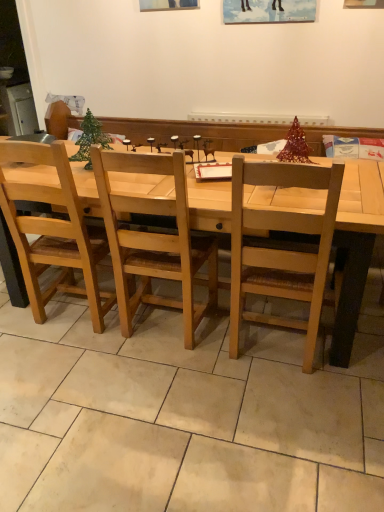
Question: Is light brown wood chair at center, the second chair positioned from the right, inside the boundaries of natural wood table at center, or outside?

Choices:
 (A) outside
 (B) inside

Answer: (B)

Question: Is point (41, 154) positioned closer to the camera than point (344, 237)?

Choices:
 (A) farther
 (B) closer

Answer: (A)

Question: Considering the real-world distances, which object is farthest from the natural wood table at center?

Choices:
 (A) metallic green christmas tree at center
 (B) light brown wood chair at center, the second chair positioned from the right
 (C) light wood chair at center, the 2th chair viewed from the left

Answer: (A)

Question: Estimate the real-world distances between objects in this image. Which object is closer to the natural wood table at center?

Choices:
 (A) light wood chair at center, the 2th chair viewed from the left
 (B) metallic green christmas tree at center
 (C) light brown wood chair at center, the first chair positioned from the left

Answer: (A)